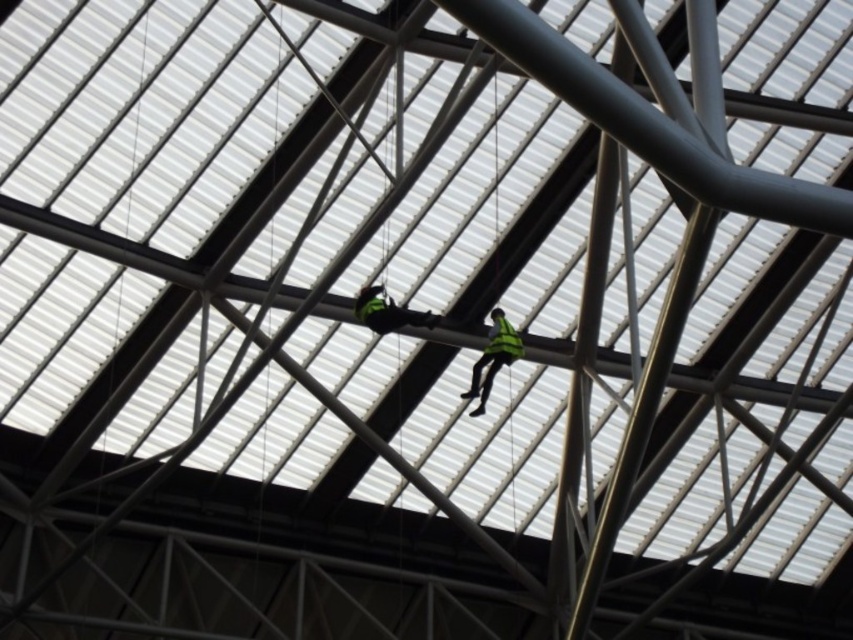
Question: Estimate the real-world distances between objects in this image. Which object is farther from the green matte safety vest at center?

Choices:
 (A) green reflective vest at center
 (B) green reflective vest at upper center

Answer: (A)

Question: Does green reflective vest at center appear on the left side of green matte safety vest at center?

Choices:
 (A) yes
 (B) no

Answer: (A)

Question: Which object appears farthest from the camera in this image?

Choices:
 (A) green reflective vest at center
 (B) green matte safety vest at center
 (C) green reflective vest at upper center

Answer: (C)

Question: Estimate the real-world distances between objects in this image. Which object is farther from the green reflective vest at center?

Choices:
 (A) green reflective vest at upper center
 (B) green matte safety vest at center

Answer: (B)

Question: Is green reflective vest at upper center below green matte safety vest at center?

Choices:
 (A) no
 (B) yes

Answer: (B)

Question: Is green reflective vest at upper center above green reflective vest at center?

Choices:
 (A) yes
 (B) no

Answer: (B)